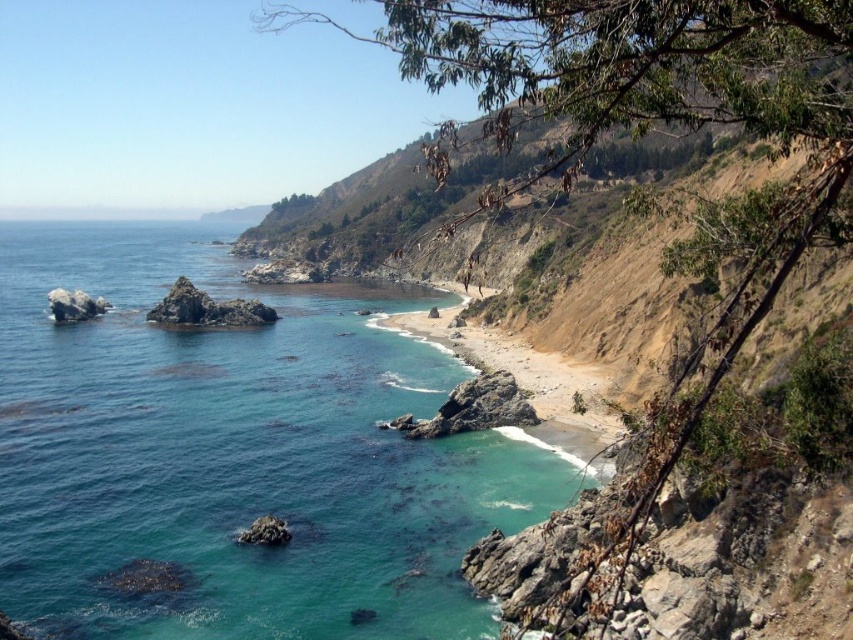
In the scene shown: You are standing at the point marked by coordinates point (235, 454) in the coastal landscape. Looking around, what do you see immediately in front of you?

You see clear blue water at lower left immediately in front of you at point (235, 454).